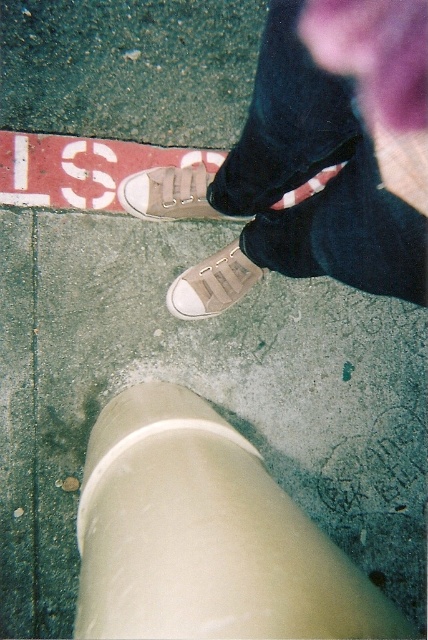
Can you confirm if matte beige sneakers at center is wider than red plastic sign at upper left?

No.

Does point (321, 221) lie in front of point (101, 188)?

That is True.

Where is `matte beige sneakers at center`? This screenshot has width=428, height=640. matte beige sneakers at center is located at coordinates (315, 160).

Does white smooth concrete at lower center have a lesser width compared to red plastic sign at upper left?

Indeed, white smooth concrete at lower center has a lesser width compared to red plastic sign at upper left.

Does white smooth concrete at lower center have a greater height compared to red plastic sign at upper left?

In fact, white smooth concrete at lower center may be shorter than red plastic sign at upper left.

Where is `white smooth concrete at lower center`? white smooth concrete at lower center is located at coordinates (205, 536).

Can you confirm if red plastic sign at upper left is positioned below white canvas shoe at center?

Actually, red plastic sign at upper left is above white canvas shoe at center.

Is point (53, 140) behind point (169, 291)?

No, (53, 140) is in front of (169, 291).

The height and width of the screenshot is (640, 428). I want to click on red plastic sign at upper left, so click(80, 168).